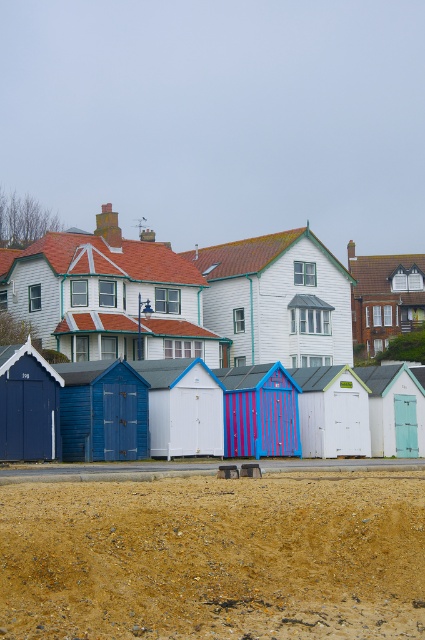
You are standing on the beach and looking at the brown sandy dirt at lower center and the white wooden house at upper center. Which object is closer to you?

The brown sandy dirt at lower center is closer to you because it is positioned below the white wooden house at upper center, indicating it is nearer in the scene.

You are a tourist standing in front of the shiny metallic beach hut at center and the matte blue beach hut at left. You want to know which one you can see the top of more easily. Which beach hut allows you to see its top more easily?

The shiny metallic beach hut at center is not as tall as the matte blue beach hut at left, so you can see the top of the shiny metallic beach hut at center more easily because it is shorter.